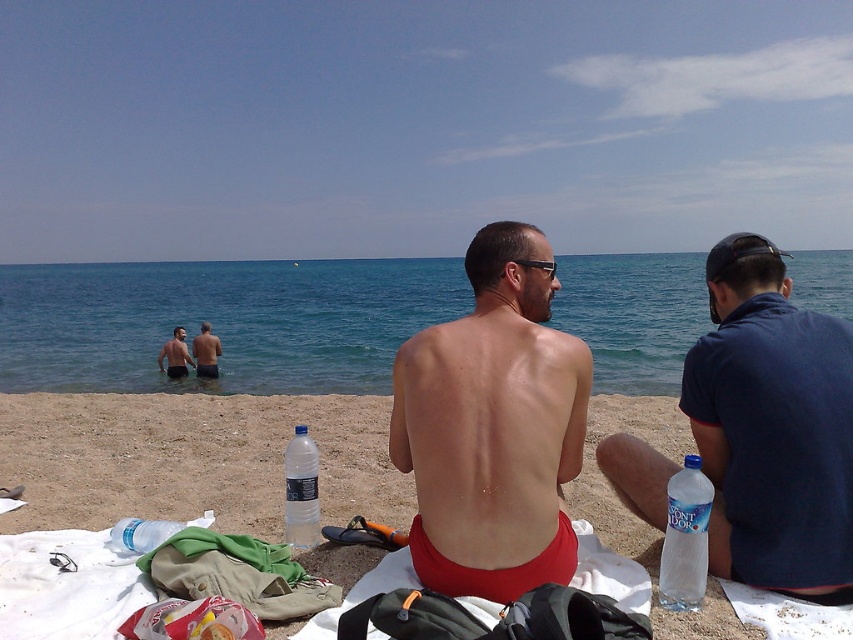
Is point (428, 586) more distant than point (144, 540)?

No, it is in front of (144, 540).

This screenshot has height=640, width=853. Find the location of `matte red shorts at center`. matte red shorts at center is located at coordinates (492, 426).

Identify the location of matte red shorts at center. The image size is (853, 640). (492, 426).

Does point (206, 342) come behind point (183, 371)?

Yes, it is.

Is smooth skin torso at center bigger than smooth skin man at center?

Yes, smooth skin torso at center is bigger than smooth skin man at center.

Which is in front, point (206, 324) or point (169, 348)?

Point (169, 348) is in front.

This screenshot has height=640, width=853. I want to click on smooth skin torso at center, so click(x=206, y=353).

Does transparent plastic bottle at center have a larger size compared to smooth skin man at center?

Actually, transparent plastic bottle at center might be smaller than smooth skin man at center.

Is point (305, 486) closer to viewer compared to point (172, 376)?

Yes, point (305, 486) is closer to viewer.

At what (x,y) coordinates should I click in order to perform the action: click on transparent plastic bottle at center. Please return your answer as a coordinate pair (x, y). Looking at the image, I should click on (300, 490).